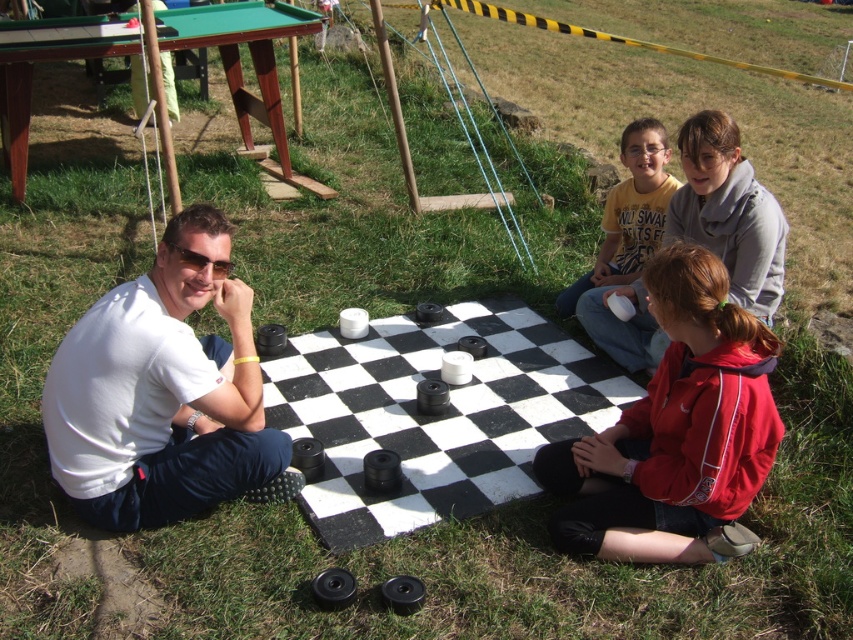
You are a photographer standing at the position of the man in the white matte shirt at left. You want to take a photo of the young girl in a red jacket who is 2.78 meters away from you. What is the minimum distance you need to move backward so that the entire checkerboard and both participants can fit into the frame?

The minimum distance you need to move backward is 2.78 meters to ensure the entire checkerboard and both participants are within the frame.

You are standing at the center of the checkerboard and want to greet the person wearing the white matte shirt at left. In which direction should you move to reach them?

The white matte shirt at left is located at point 0.614 on the x axis and 0.193 on the y axis. Since the checkerboard is centered at (426, 320), moving towards the left and slightly downward from the center would reach the white matte shirt at left.

Looking at this image, you are a photographer trying to capture a photo of the black rubber checkerboard at center and the red fleece jacket at lower right. From the photographer perspective, which object is closer to the camera?

The red fleece jacket at lower right is closer to the camera because the black rubber checkerboard at center is located above it, meaning the checkerboard is farther away in the scene.